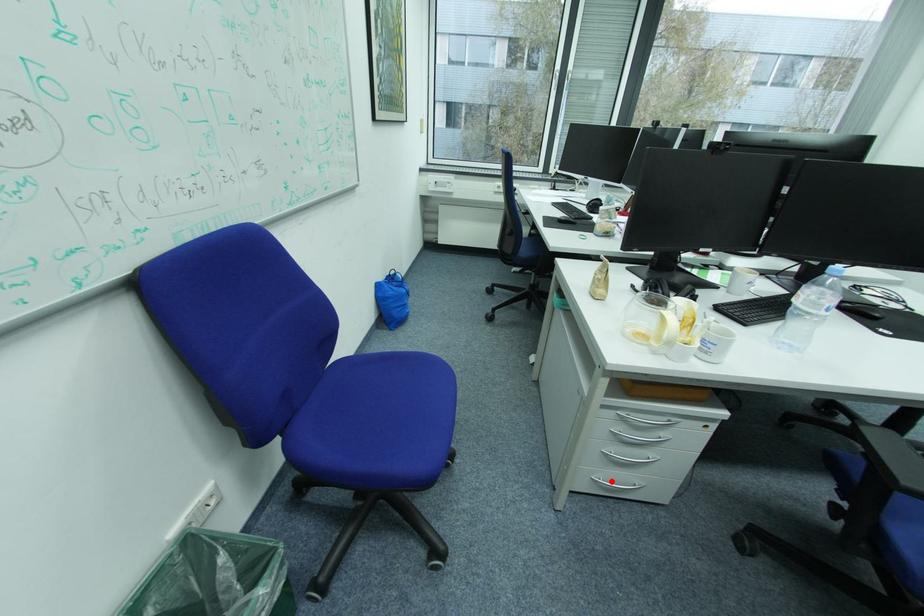
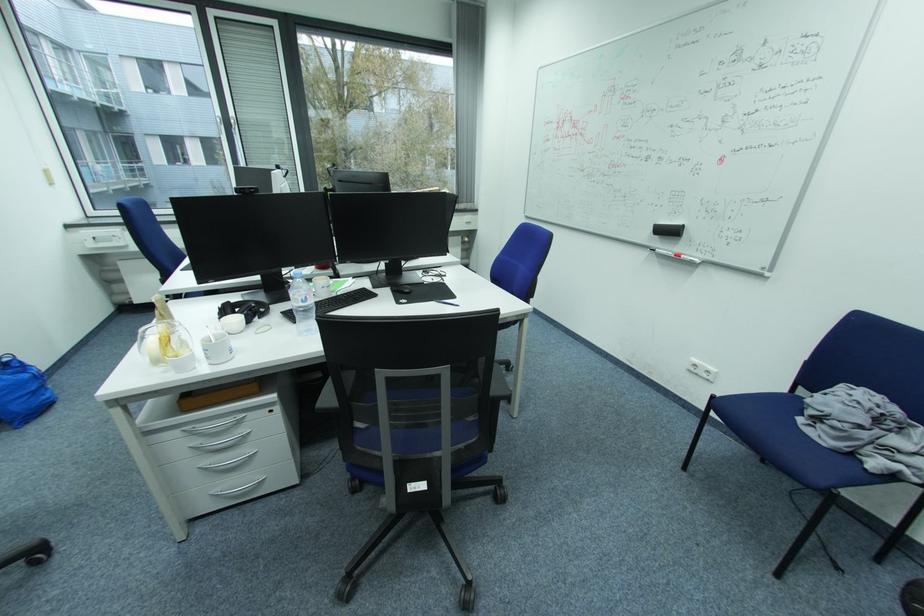
Find the pixel in the second image that matches the highlighted location in the first image.

(229, 493)